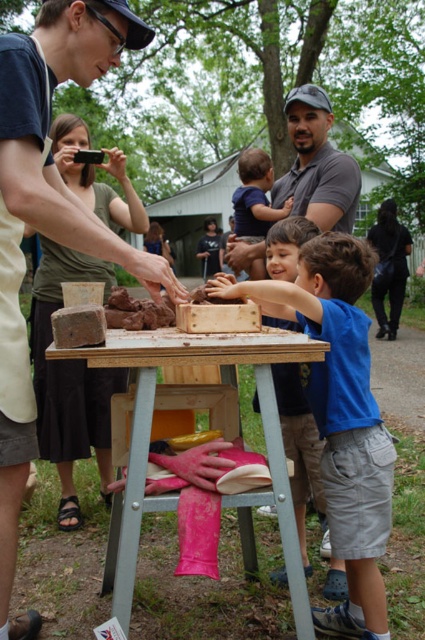
Question: Which of the following is the closest to the observer?

Choices:
 (A) blue cotton shirt at center
 (B) black leather jacket at lower right
 (C) matte black shirt at upper left

Answer: (C)

Question: Is matte green shirt at upper left below black leather jacket at lower right?

Choices:
 (A) no
 (B) yes

Answer: (B)

Question: Which of these objects is positioned closest to the matte green shirt at upper left?

Choices:
 (A) black leather jacket at lower right
 (B) wooden table at center
 (C) blue cotton shirt at center

Answer: (B)

Question: Which point is farther to the camera?

Choices:
 (A) wooden table at center
 (B) matte black shirt at upper left

Answer: (B)

Question: Does matte black shirt at upper left have a greater width compared to matte green shirt at upper left?

Choices:
 (A) no
 (B) yes

Answer: (A)

Question: Does matte black shirt at upper left have a greater width compared to black leather jacket at lower right?

Choices:
 (A) yes
 (B) no

Answer: (B)